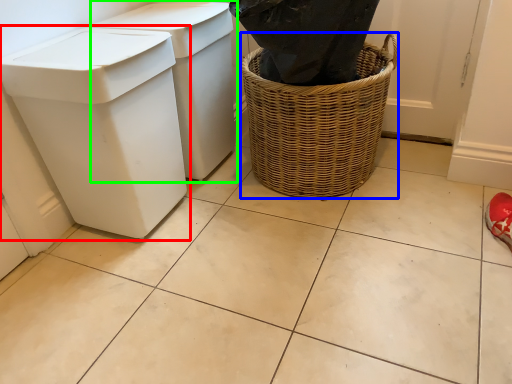
Question: Which object is positioned farthest from waste container (highlighted by a red box)? Select from basket container (highlighted by a blue box) and waste container (highlighted by a green box).

Choices:
 (A) basket container
 (B) waste container

Answer: (A)